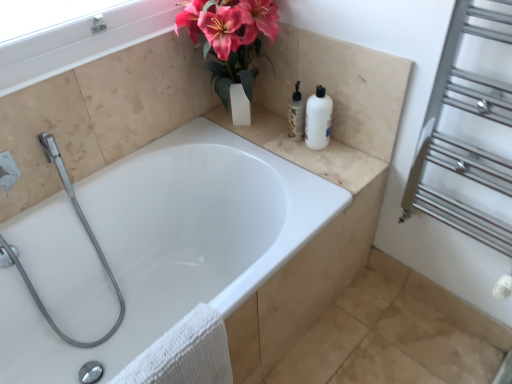
Find the location of a particular element. free space above beige marble counter top at upper right (from a real-world perspective) is located at coordinates (311, 146).